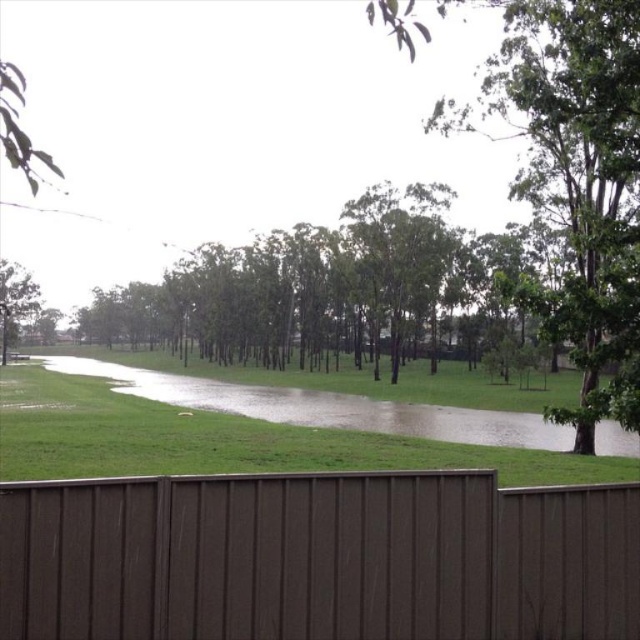
Question: Which point appears closest to the camera in this image?

Choices:
 (A) (433, 259)
 (B) (452, 416)
 (C) (19, 506)
 (D) (8, 337)

Answer: (C)

Question: Among these objects, which one is farthest from the camera?

Choices:
 (A) green leafy tree at left
 (B) green leafy tree at upper right
 (C) green leafy tree at center
 (D) green grassy water at center

Answer: (A)

Question: Is brown corrugated fence at lower center positioned behind green leafy tree at left?

Choices:
 (A) no
 (B) yes

Answer: (A)

Question: Does brown corrugated fence at lower center have a greater width compared to green grassy water at center?

Choices:
 (A) no
 (B) yes

Answer: (A)

Question: Does brown corrugated fence at lower center appear on the left side of green leafy tree at center?

Choices:
 (A) yes
 (B) no

Answer: (B)

Question: Which point is farther to the camera?

Choices:
 (A) pos(310,500)
 (B) pos(307,292)

Answer: (B)